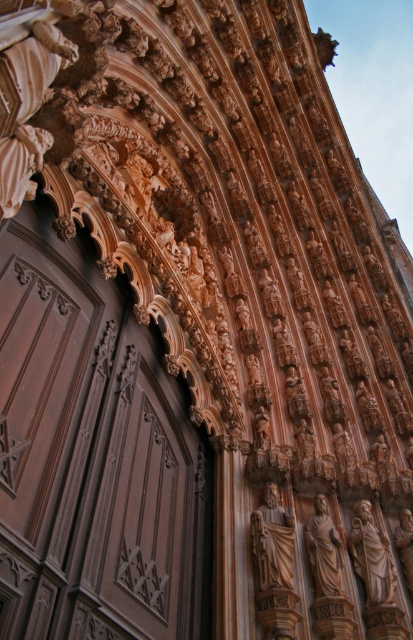
Question: Does polished wood statue at center have a larger size compared to polished bronze statue at center?

Choices:
 (A) no
 (B) yes

Answer: (B)

Question: Estimate the real-world distances between objects in this image. Which object is farther from the polished brown statue at center?

Choices:
 (A) brown polished wood door at center
 (B) polished wood statue at center

Answer: (A)

Question: Can you confirm if polished brown statue at center is bigger than smooth beige statue at center?

Choices:
 (A) no
 (B) yes

Answer: (B)

Question: Does polished brown statue at center have a lesser width compared to polished wood statue at center?

Choices:
 (A) yes
 (B) no

Answer: (B)

Question: Which of these objects is positioned closest to the polished wood statue at center?

Choices:
 (A) polished beige statue at center
 (B) smooth beige statue at center
 (C) polished bronze statue at center
 (D) polished brown statue at center

Answer: (D)

Question: Which object is the farthest from the smooth beige statue at center?

Choices:
 (A) polished bronze statue at center
 (B) polished brown statue at center

Answer: (A)